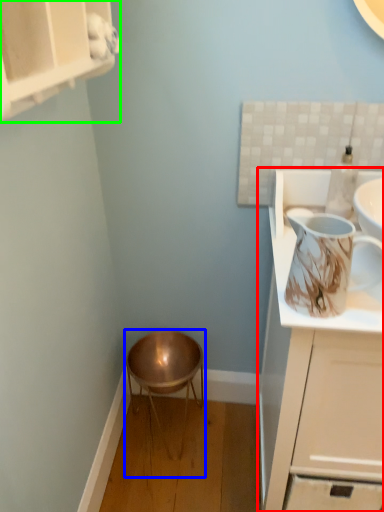
Question: Estimate the real-world distances between objects in this image. Which object is closer to cabinetry (highlighted by a red box), stool (highlighted by a blue box) or cabinetry (highlighted by a green box)?

Choices:
 (A) stool
 (B) cabinetry

Answer: (A)